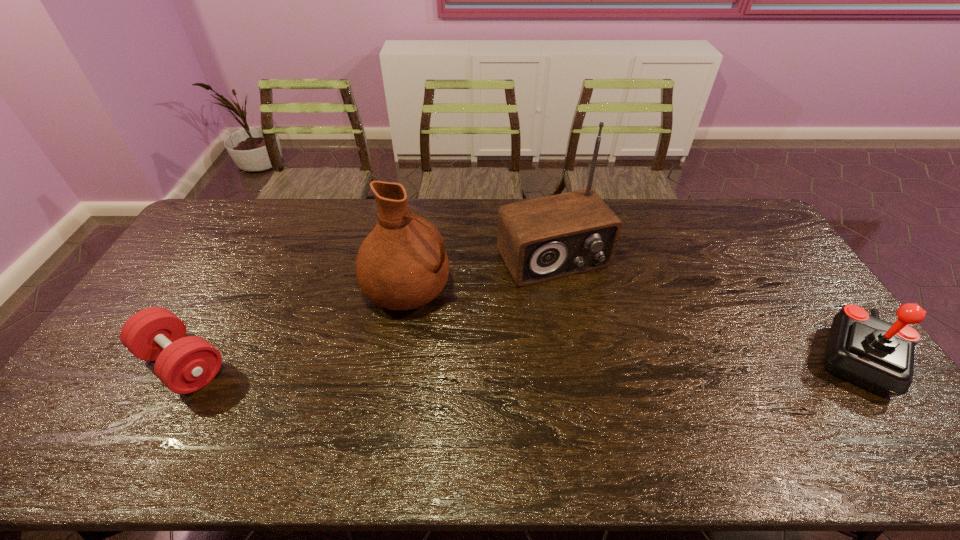
Locate an element on the screen. This screenshot has width=960, height=540. object that is at the near left corner is located at coordinates (184, 364).

Image resolution: width=960 pixels, height=540 pixels. Identify the location of object that is positioned at the near right corner. (877, 355).

The height and width of the screenshot is (540, 960). I want to click on vacant space at the far edge of the desktop, so coord(709,232).

The image size is (960, 540). In order to click on free point at the near edge in this screenshot , I will do `click(610, 399)`.

Where is `vacant space at the right edge of the desktop`? vacant space at the right edge of the desktop is located at coordinates (776, 293).

You are a GUI agent. You are given a task and a screenshot of the screen. Output one action in this format:
    pyautogui.click(x=<x>, y=<y>)
    Task: Click on the free point at the far right corner
    Image resolution: width=960 pixels, height=540 pixels.
    Given the screenshot: What is the action you would take?
    pyautogui.click(x=740, y=224)

Where is `vacant area that lies between the second shortest object and the third object from right to left`? This screenshot has width=960, height=540. vacant area that lies between the second shortest object and the third object from right to left is located at coordinates (632, 323).

I want to click on free point between the radio receiver and the pitcher, so click(x=480, y=274).

The width and height of the screenshot is (960, 540). I want to click on vacant area between the third object from left to right and the shortest object, so click(368, 311).

You are a GUI agent. You are given a task and a screenshot of the screen. Output one action in this format:
    pyautogui.click(x=<x>, y=<y>)
    Task: Click on the vacant space in between the radio receiver and the shortest object
    
    Given the screenshot: What is the action you would take?
    pyautogui.click(x=368, y=311)